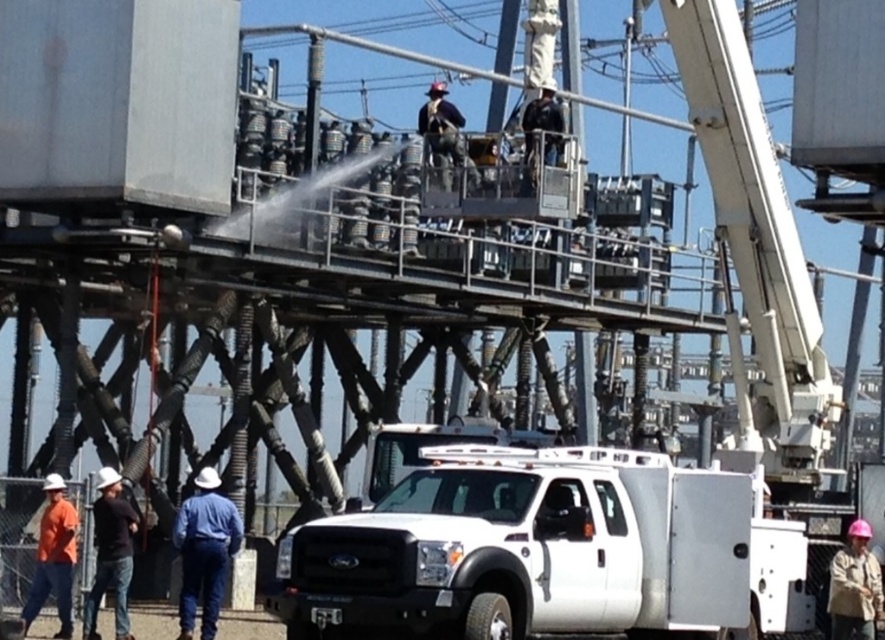
Question: Which of the following is the closest to the observer?

Choices:
 (A) white hard hat at lower left
 (B) white metallic utility truck at center

Answer: (B)

Question: Which of the following is the farthest from the observer?

Choices:
 (A) white hard hat at lower left
 (B) white metallic utility truck at center

Answer: (A)

Question: Does white metallic utility truck at center appear over orange hard hat at lower left?

Choices:
 (A) no
 (B) yes

Answer: (B)

Question: Which of the following is the farthest from the observer?

Choices:
 (A) (722, 492)
 (B) (121, 616)

Answer: (B)

Question: Is blue denim jeans at lower left thinner than orange hard hat at lower left?

Choices:
 (A) yes
 (B) no

Answer: (B)

Question: Does white hard hat at lower left have a lesser width compared to orange hard hat at lower left?

Choices:
 (A) yes
 (B) no

Answer: (A)